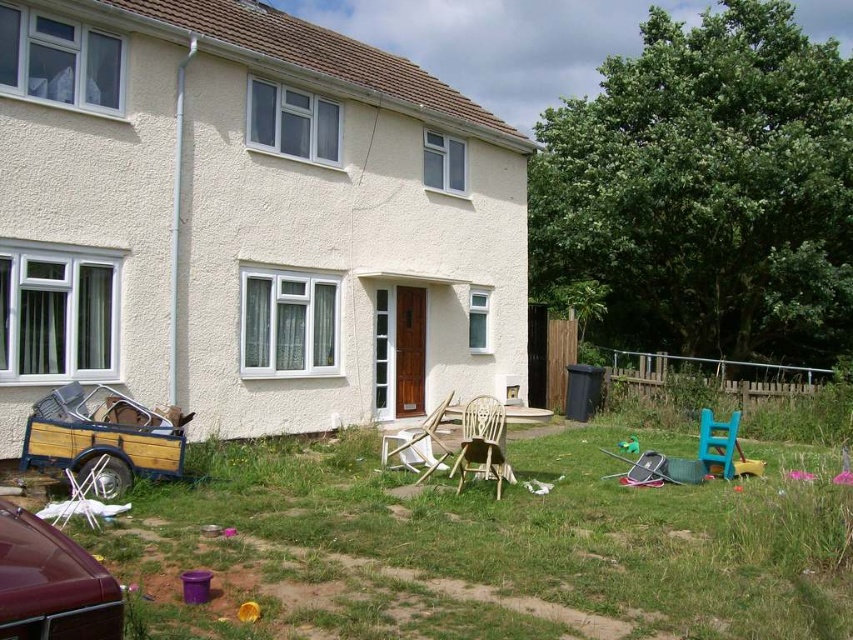
Question: Among these objects, which one is farthest from the camera?

Choices:
 (A) shiny maroon car at lower left
 (B) woven wood chair at center
 (C) wooden chair at center

Answer: (C)

Question: Does green grass at lower center appear over woven wood chair at center?

Choices:
 (A) yes
 (B) no

Answer: (B)

Question: Is shiny maroon car at lower left closer to camera compared to blue plastic chair at lower right?

Choices:
 (A) no
 (B) yes

Answer: (B)

Question: Which object appears farthest from the camera in this image?

Choices:
 (A) blue plastic chair at lower right
 (B) green grass at lower center
 (C) wooden chair at center
 (D) shiny maroon car at lower left

Answer: (A)

Question: Among these objects, which one is farthest from the camera?

Choices:
 (A) woven wood chair at center
 (B) wooden chair at center
 (C) shiny maroon car at lower left
 (D) blue plastic chair at lower right

Answer: (D)

Question: Can you confirm if green grass at lower center is positioned to the right of woven wood chair at center?

Choices:
 (A) no
 (B) yes

Answer: (A)